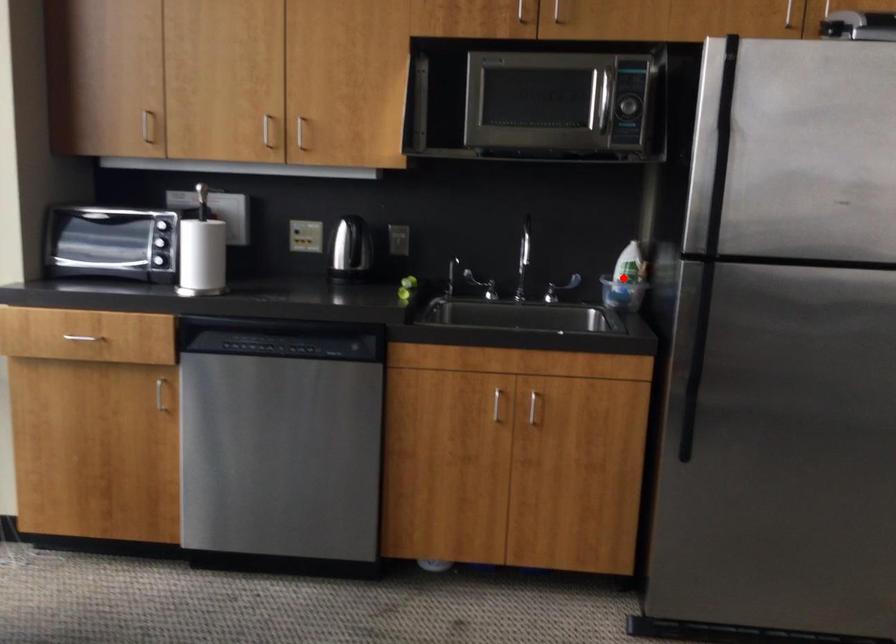
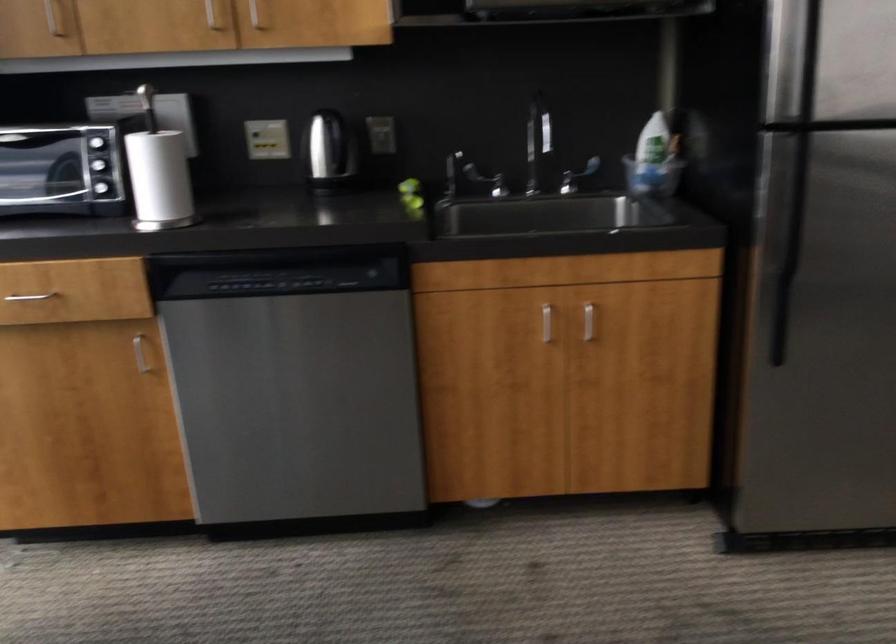
Locate, in the second image, the point that corresponds to the highlighted location in the first image.

(650, 155)